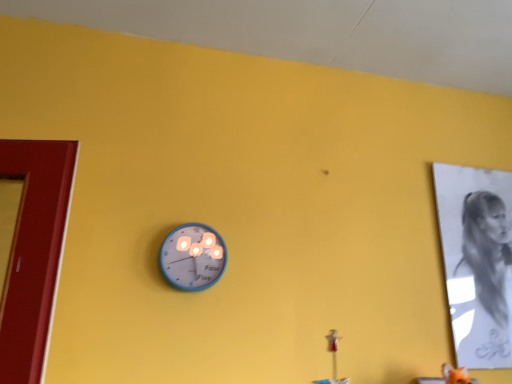
What do you see at coordinates (486, 282) in the screenshot? I see `charcoal sketch of person at right` at bounding box center [486, 282].

Locate an element on the screen. charcoal sketch of person at right is located at coordinates (486, 282).

Find the location of a particular element. The height and width of the screenshot is (384, 512). blue metallic wall clock at center is located at coordinates (193, 257).

What do you see at coordinates (193, 257) in the screenshot? I see `blue metallic wall clock at center` at bounding box center [193, 257].

This screenshot has width=512, height=384. Identify the location of charcoal sketch of person at right. (486, 282).

Visually, is blue metallic wall clock at center positioned to the left or to the right of charcoal sketch of person at right?

Based on their positions, blue metallic wall clock at center is located to the left of charcoal sketch of person at right.

Is the depth of blue metallic wall clock at center greater than that of charcoal sketch of person at right?

No, blue metallic wall clock at center is closer to the camera.

Is point (200, 257) closer to camera compared to point (497, 304)?

Yes, point (200, 257) is closer to viewer.

From the image's perspective, which one is positioned higher, blue metallic wall clock at center or charcoal sketch of person at right?

blue metallic wall clock at center appears higher in the image.

From a real-world perspective, is blue metallic wall clock at center physically located above or below charcoal sketch of person at right?

blue metallic wall clock at center is situated lower than charcoal sketch of person at right in the real world.

Can you confirm if blue metallic wall clock at center is thinner than charcoal sketch of person at right?

No.

Between blue metallic wall clock at center and charcoal sketch of person at right, which one has more height?

charcoal sketch of person at right.

Can you confirm if blue metallic wall clock at center is smaller than charcoal sketch of person at right?

Correct, blue metallic wall clock at center occupies less space than charcoal sketch of person at right.

Which is correct: blue metallic wall clock at center is inside charcoal sketch of person at right, or outside of it?

blue metallic wall clock at center is spatially situated outside charcoal sketch of person at right.

Is blue metallic wall clock at center directly adjacent to charcoal sketch of person at right?

No, blue metallic wall clock at center is not touching charcoal sketch of person at right.

Is blue metallic wall clock at center positioned with its back to charcoal sketch of person at right?

blue metallic wall clock at center is not turned away from charcoal sketch of person at right.

How different are the orientations of blue metallic wall clock at center and charcoal sketch of person at right in degrees?

The angular difference between blue metallic wall clock at center and charcoal sketch of person at right is 0.000363 degrees.

What are the coordinates of `person behind the blue metallic wall clock at center` in the screenshot? It's located at (486, 282).

Looking at this image, which object is positioned more to the right, charcoal sketch of person at right or blue metallic wall clock at center?

charcoal sketch of person at right is more to the right.

Is the position of charcoal sketch of person at right more distant than that of blue metallic wall clock at center?

Yes, it is behind blue metallic wall clock at center.

Is point (489, 350) less distant than point (185, 235)?

No.

From the image's perspective, does charcoal sketch of person at right appear lower than blue metallic wall clock at center?

Yes.

From a real-world perspective, is charcoal sketch of person at right beneath blue metallic wall clock at center?

No, from a real-world perspective, charcoal sketch of person at right is not under blue metallic wall clock at center.

Between charcoal sketch of person at right and blue metallic wall clock at center, which one has smaller width?

Thinner between the two is charcoal sketch of person at right.

Can you confirm if charcoal sketch of person at right is taller than blue metallic wall clock at center?

Indeed, charcoal sketch of person at right has a greater height compared to blue metallic wall clock at center.

Which of these two, charcoal sketch of person at right or blue metallic wall clock at center, is smaller?

blue metallic wall clock at center is smaller.

Is charcoal sketch of person at right inside or outside of blue metallic wall clock at center?

charcoal sketch of person at right is spatially situated outside blue metallic wall clock at center.

Are charcoal sketch of person at right and blue metallic wall clock at center far apart?

No, charcoal sketch of person at right is not far from blue metallic wall clock at center.

Is blue metallic wall clock at center at the back of charcoal sketch of person at right?

charcoal sketch of person at right does not have its back to blue metallic wall clock at center.

Measure the distance between charcoal sketch of person at right and blue metallic wall clock at center.

charcoal sketch of person at right is 90.00 centimeters from blue metallic wall clock at center.

Find the location of a particular element. The width and height of the screenshot is (512, 384). person lying on the right of blue metallic wall clock at center is located at coordinates (486, 282).

The width and height of the screenshot is (512, 384). Identify the location of wall clock on the left side of charcoal sketch of person at right. (193, 257).

You are a GUI agent. You are given a task and a screenshot of the screen. Output one action in this format:
    pyautogui.click(x=<x>, y=<y>)
    Task: Click on the wall clock below the charcoal sketch of person at right (from a real-world perspective)
    The width and height of the screenshot is (512, 384).
    Given the screenshot: What is the action you would take?
    pyautogui.click(x=193, y=257)